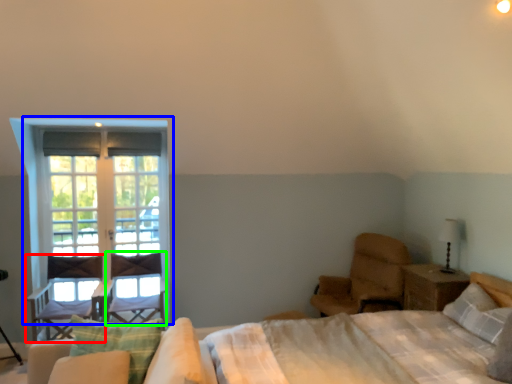
Question: Considering the real-world distances, which object is closest to chair (highlighted by a red box)? window (highlighted by a blue box) or swivel chair (highlighted by a green box).

Choices:
 (A) window
 (B) swivel chair

Answer: (B)